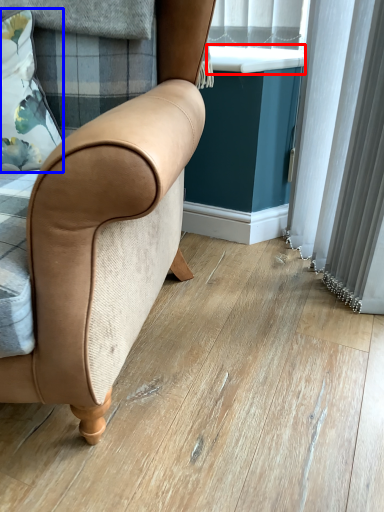
Question: Which point is further to the camera, window sill (highlighted by a red box) or pillow (highlighted by a blue box)?

Choices:
 (A) window sill
 (B) pillow

Answer: (A)